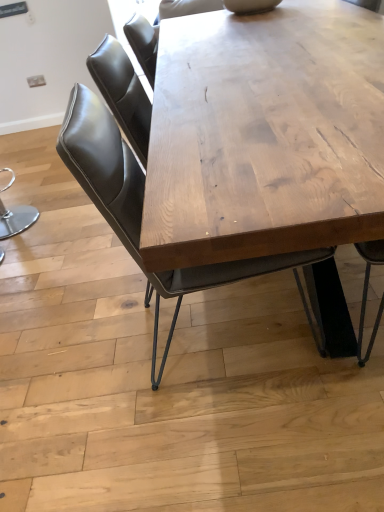
Locate an element on the screen. The image size is (384, 512). leather seat at center is located at coordinates pos(142,208).

Describe the element at coordinates (142, 208) in the screenshot. I see `leather seat at center` at that location.

In order to face natural wood table at center, should I rotate leftwards or rightwards?

Turn right approximately 12.365 degrees to face it.

The image size is (384, 512). Describe the element at coordinates (265, 135) in the screenshot. I see `natural wood table at center` at that location.

The height and width of the screenshot is (512, 384). What are the coordinates of `natural wood table at center` in the screenshot? It's located at (265, 135).

Locate an element on the screen. Image resolution: width=384 pixels, height=512 pixels. leather seat at center is located at coordinates (142, 208).

Based on their positions, is natural wood table at center located to the left or right of leather seat at center?

Clearly, natural wood table at center is on the right of leather seat at center in the image.

In the scene shown: Is natural wood table at center in front of or behind leather seat at center in the image?

Clearly, natural wood table at center is in front of leather seat at center.

Which is closer, (242,96) or (101,150)?

Point (242,96).

From the image's perspective, which one is positioned higher, natural wood table at center or leather seat at center?

natural wood table at center is shown above in the image.

From a real-world perspective, between natural wood table at center and leather seat at center, who is vertically higher?

leather seat at center is physically above.

Which of these two, natural wood table at center or leather seat at center, is thinner?

leather seat at center.

Who is taller, natural wood table at center or leather seat at center?

leather seat at center.

Looking at the image, does natural wood table at center seem bigger or smaller compared to leather seat at center?

Clearly, natural wood table at center is larger in size than leather seat at center.

Choose the correct answer: Is natural wood table at center inside leather seat at center or outside it?

natural wood table at center exists outside the volume of leather seat at center.

Is natural wood table at center far away from leather seat at center?

Actually, natural wood table at center and leather seat at center are a little close together.

Looking at this image, is natural wood table at center turned away from leather seat at center?

Yes.

How distant is natural wood table at center from leather seat at center?

natural wood table at center and leather seat at center are 15.49 inches apart from each other.

The height and width of the screenshot is (512, 384). I want to click on coffee table located above the leather seat at center (from the image's perspective), so coord(265,135).

Is leather seat at center at the right side of natural wood table at center?

No, leather seat at center is not to the right of natural wood table at center.

Relative to natural wood table at center, is leather seat at center in front or behind?

Clearly, leather seat at center is behind natural wood table at center.

Is point (57, 148) closer or farther from the camera than point (355, 127)?

Point (57, 148) is closer to the camera than point (355, 127).

From the image's perspective, who appears lower, leather seat at center or natural wood table at center?

leather seat at center appears lower in the image.

From a real-world perspective, is leather seat at center positioned over natural wood table at center based on gravity?

Indeed, from a real-world perspective, leather seat at center stands above natural wood table at center.

Between leather seat at center and natural wood table at center, which one has larger width?

natural wood table at center.

Which of these two, leather seat at center or natural wood table at center, stands taller?

Standing taller between the two is leather seat at center.

In the scene shown: Which of these two, leather seat at center or natural wood table at center, is smaller?

leather seat at center is smaller.

Is natural wood table at center located within leather seat at center?

No, natural wood table at center is located outside of leather seat at center.

Is leather seat at center positioned far away from natural wood table at center?

Actually, leather seat at center and natural wood table at center are a little close together.

Is leather seat at center looking in the opposite direction of natural wood table at center?

Yes.

How far apart are leather seat at center and natural wood table at center?

leather seat at center and natural wood table at center are 39.34 centimeters apart from each other.

The height and width of the screenshot is (512, 384). Identify the location of coffee table above the leather seat at center (from the image's perspective). (265, 135).

In order to click on coffee table in front of the leather seat at center in this screenshot , I will do `click(265, 135)`.

Locate an element on the screen. Image resolution: width=384 pixels, height=512 pixels. chair lying below the natural wood table at center (from the image's perspective) is located at coordinates (142, 208).